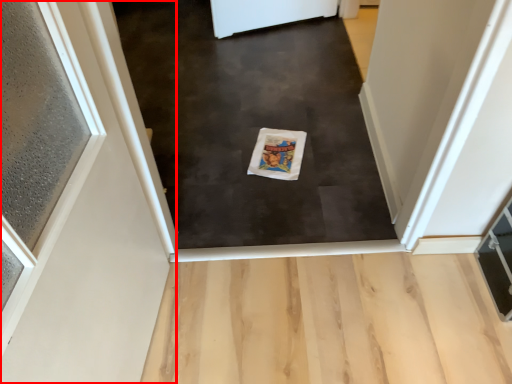
Question: Considering the relative positions of door (annotated by the red box) and mat in the image provided, where is door (annotated by the red box) located with respect to the staircase?

Choices:
 (A) right
 (B) left

Answer: (B)